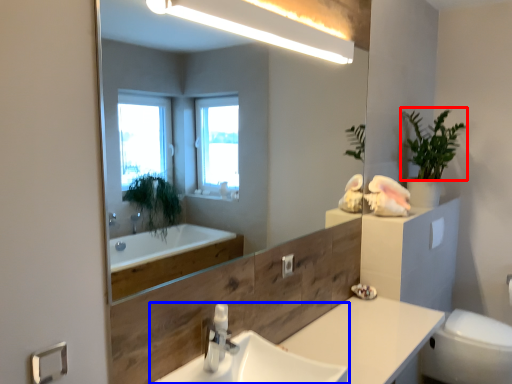
Question: Which point is closer to the camera, plant (highlighted by a red box) or sink (highlighted by a blue box)?

Choices:
 (A) plant
 (B) sink

Answer: (B)